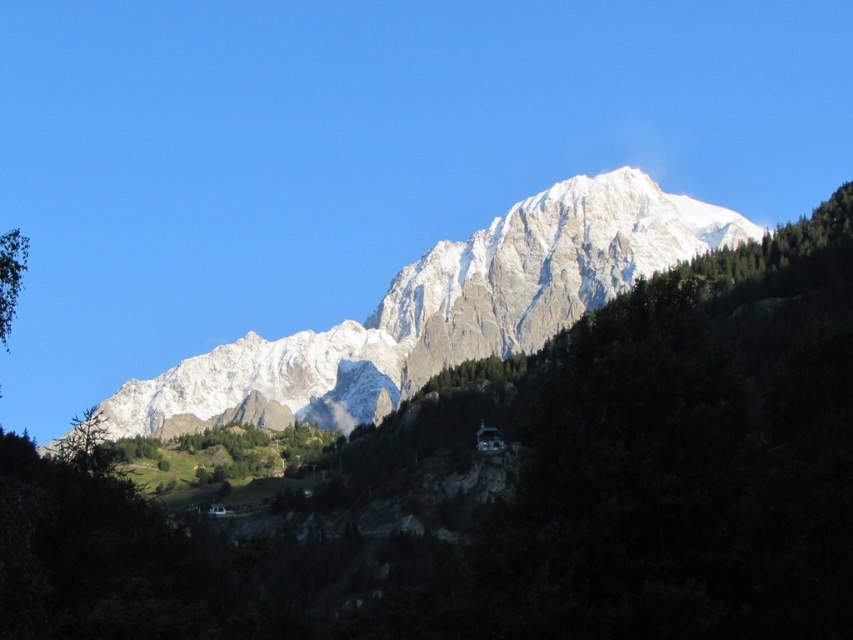
What are the coordinates of the white crystalline mountain range at center in the image?

The white crystalline mountain range at center is located at coordinates point (440, 310).

You are an architect planning to build a new cabin. You have a blueprint that requires a space wider than the green leafy tree at left. Can the white crystalline mountain range at center provide enough width for your blueprint?

The white crystalline mountain range at center is wider than the green leafy tree at left, so it can provide enough width for the blueprint.